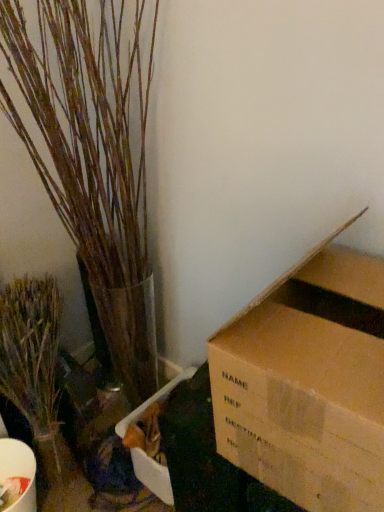
Question: Does bark-like textured plant at left, which is the first houseplant in right-to-left order, have a larger size compared to green matte plant at left, acting as the 1th houseplant starting from the left?

Choices:
 (A) yes
 (B) no

Answer: (A)

Question: From the image's perspective, is bark-like textured plant at left, which is the first houseplant in right-to-left order, beneath green matte plant at left, positioned as the 2th houseplant in right-to-left order?

Choices:
 (A) yes
 (B) no

Answer: (B)

Question: Is bark-like textured plant at left, which is the first houseplant in right-to-left order, shorter than green matte plant at left, positioned as the 2th houseplant in right-to-left order?

Choices:
 (A) yes
 (B) no

Answer: (B)

Question: Does bark-like textured plant at left, which is the first houseplant in right-to-left order, have a smaller size compared to green matte plant at left, positioned as the 2th houseplant in right-to-left order?

Choices:
 (A) no
 (B) yes

Answer: (A)

Question: Can you confirm if bark-like textured plant at left, the 2th houseplant in the left-to-right sequence, is wider than green matte plant at left, positioned as the 2th houseplant in right-to-left order?

Choices:
 (A) no
 (B) yes

Answer: (B)

Question: Is bark-like textured plant at left, the 2th houseplant in the left-to-right sequence, in contact with green matte plant at left, positioned as the 2th houseplant in right-to-left order?

Choices:
 (A) yes
 (B) no

Answer: (B)

Question: Does green matte plant at left, positioned as the 2th houseplant in right-to-left order, have a smaller size compared to bark-like textured plant at left, which is the first houseplant in right-to-left order?

Choices:
 (A) yes
 (B) no

Answer: (A)

Question: Considering the relative sizes of green matte plant at left, positioned as the 2th houseplant in right-to-left order, and bark-like textured plant at left, the 2th houseplant in the left-to-right sequence, in the image provided, is green matte plant at left, positioned as the 2th houseplant in right-to-left order, thinner than bark-like textured plant at left, the 2th houseplant in the left-to-right sequence,?

Choices:
 (A) yes
 (B) no

Answer: (A)

Question: From a real-world perspective, is green matte plant at left, acting as the 1th houseplant starting from the left, on top of bark-like textured plant at left, the 2th houseplant in the left-to-right sequence?

Choices:
 (A) no
 (B) yes

Answer: (A)

Question: Is green matte plant at left, positioned as the 2th houseplant in right-to-left order, not within bark-like textured plant at left, which is the first houseplant in right-to-left order?

Choices:
 (A) yes
 (B) no

Answer: (B)

Question: Considering the relative sizes of green matte plant at left, acting as the 1th houseplant starting from the left, and bark-like textured plant at left, the 2th houseplant in the left-to-right sequence, in the image provided, is green matte plant at left, acting as the 1th houseplant starting from the left, taller than bark-like textured plant at left, the 2th houseplant in the left-to-right sequence,?

Choices:
 (A) yes
 (B) no

Answer: (B)

Question: Does green matte plant at left, positioned as the 2th houseplant in right-to-left order, appear on the right side of bark-like textured plant at left, which is the first houseplant in right-to-left order?

Choices:
 (A) no
 (B) yes

Answer: (A)

Question: Considering the positions of bark-like textured plant at left, which is the first houseplant in right-to-left order, and green matte plant at left, positioned as the 2th houseplant in right-to-left order, in the image, is bark-like textured plant at left, which is the first houseplant in right-to-left order, bigger or smaller than green matte plant at left, positioned as the 2th houseplant in right-to-left order,?

Choices:
 (A) small
 (B) big

Answer: (B)